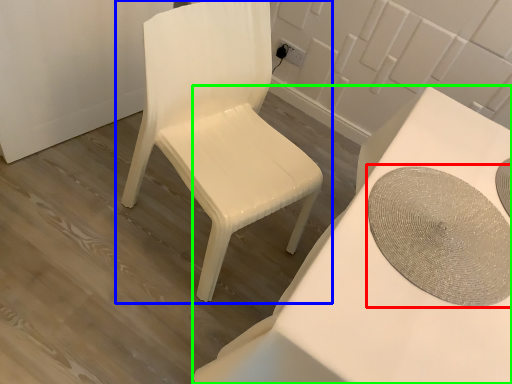
Question: Considering the real-world distances, which object is farthest from round table (highlighted by a red box)? chair (highlighted by a blue box) or table (highlighted by a green box)?

Choices:
 (A) chair
 (B) table

Answer: (A)